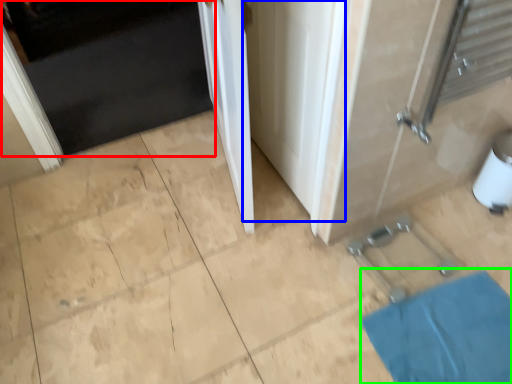
Question: Which object is the farthest from door (highlighted by a red box)? Choose among these: screen door (highlighted by a blue box) or bath mat (highlighted by a green box).

Choices:
 (A) screen door
 (B) bath mat

Answer: (B)